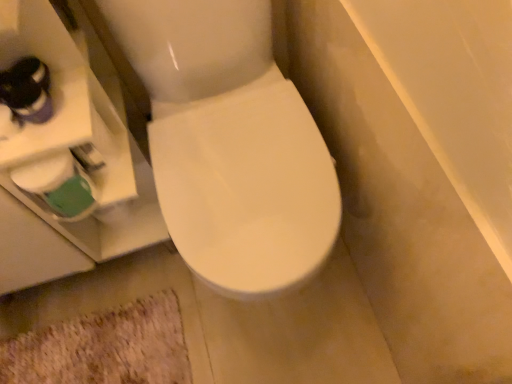
This screenshot has width=512, height=384. In order to click on beige shaggy bath mat at lower left in this screenshot , I will do `click(103, 348)`.

What do you see at coordinates (103, 348) in the screenshot? This screenshot has height=384, width=512. I see `beige shaggy bath mat at lower left` at bounding box center [103, 348].

What do you see at coordinates (58, 185) in the screenshot?
I see `white matte toilet paper at lower left` at bounding box center [58, 185].

What is the approximate height of white matte toilet paper at lower left?

13.02 centimeters.

I want to click on white matte toilet paper at lower left, so click(x=58, y=185).

Locate an element on the screen. beige shaggy bath mat at lower left is located at coordinates (103, 348).

Can you confirm if white matte toilet paper at lower left is positioned to the right of beige shaggy bath mat at lower left?

Correct, you'll find white matte toilet paper at lower left to the right of beige shaggy bath mat at lower left.

Is the position of white matte toilet paper at lower left less distant than that of beige shaggy bath mat at lower left?

That is True.

Is point (69, 183) closer or farther from the camera than point (52, 349)?

Point (69, 183) is closer to the camera than point (52, 349).

From the image's perspective, who appears lower, white matte toilet paper at lower left or beige shaggy bath mat at lower left?

beige shaggy bath mat at lower left appears lower in the image.

From a real-world perspective, between white matte toilet paper at lower left and beige shaggy bath mat at lower left, who is vertically higher?

From a 3D spatial view, white matte toilet paper at lower left is above.

Considering the relative sizes of white matte toilet paper at lower left and beige shaggy bath mat at lower left in the image provided, is white matte toilet paper at lower left thinner than beige shaggy bath mat at lower left?

Indeed, white matte toilet paper at lower left has a lesser width compared to beige shaggy bath mat at lower left.

Which of these two, white matte toilet paper at lower left or beige shaggy bath mat at lower left, stands taller?

white matte toilet paper at lower left is taller.

Between white matte toilet paper at lower left and beige shaggy bath mat at lower left, which one has larger size?

With larger size is beige shaggy bath mat at lower left.

Which is correct: white matte toilet paper at lower left is inside beige shaggy bath mat at lower left, or outside of it?

white matte toilet paper at lower left cannot be found inside beige shaggy bath mat at lower left.

Would you say white matte toilet paper at lower left is a long distance from beige shaggy bath mat at lower left?

No, white matte toilet paper at lower left is not far away from beige shaggy bath mat at lower left.

Is white matte toilet paper at lower left turned away from beige shaggy bath mat at lower left?

That's not correct — white matte toilet paper at lower left is not looking away from beige shaggy bath mat at lower left.

Can you tell me how much white matte toilet paper at lower left and beige shaggy bath mat at lower left differ in facing direction?

The facing directions of white matte toilet paper at lower left and beige shaggy bath mat at lower left are 1.49 degrees apart.

In the image, there is a white matte toilet paper at lower left. Identify the location of bath mat below it (from the image's perspective). (103, 348).

Between beige shaggy bath mat at lower left and white matte toilet paper at lower left, which one appears on the left side from the viewer's perspective?

From the viewer's perspective, beige shaggy bath mat at lower left appears more on the left side.

Looking at this image, is the position of beige shaggy bath mat at lower left less distant than that of white matte toilet paper at lower left?

No, beige shaggy bath mat at lower left is further to the viewer.

Is point (169, 299) behind point (80, 184)?

Yes, it is.

From the image's perspective, which is below, beige shaggy bath mat at lower left or white matte toilet paper at lower left?

beige shaggy bath mat at lower left is shown below in the image.

From a real-world perspective, is beige shaggy bath mat at lower left physically below white matte toilet paper at lower left?

Yes, from a real-world perspective, beige shaggy bath mat at lower left is below white matte toilet paper at lower left.

Can you confirm if beige shaggy bath mat at lower left is wider than white matte toilet paper at lower left?

Yes.

Considering the sizes of objects beige shaggy bath mat at lower left and white matte toilet paper at lower left in the image provided, who is shorter, beige shaggy bath mat at lower left or white matte toilet paper at lower left?

beige shaggy bath mat at lower left is shorter.

Is beige shaggy bath mat at lower left smaller than white matte toilet paper at lower left?

No, beige shaggy bath mat at lower left is not smaller than white matte toilet paper at lower left.

Is beige shaggy bath mat at lower left inside or outside of white matte toilet paper at lower left?

beige shaggy bath mat at lower left is located beyond the bounds of white matte toilet paper at lower left.

In the scene shown: Is beige shaggy bath mat at lower left placed right next to white matte toilet paper at lower left?

No, beige shaggy bath mat at lower left is not beside white matte toilet paper at lower left.

Could you tell me if beige shaggy bath mat at lower left is facing white matte toilet paper at lower left?

No.

Image resolution: width=512 pixels, height=384 pixels. Identify the location of toilet paper that is above the beige shaggy bath mat at lower left (from a real-world perspective). (58, 185).

Locate an element on the screen. This screenshot has width=512, height=384. toilet paper in front of the beige shaggy bath mat at lower left is located at coordinates (58, 185).

In the image, there is a beige shaggy bath mat at lower left. Identify the location of toilet paper above it (from the image's perspective). (58, 185).